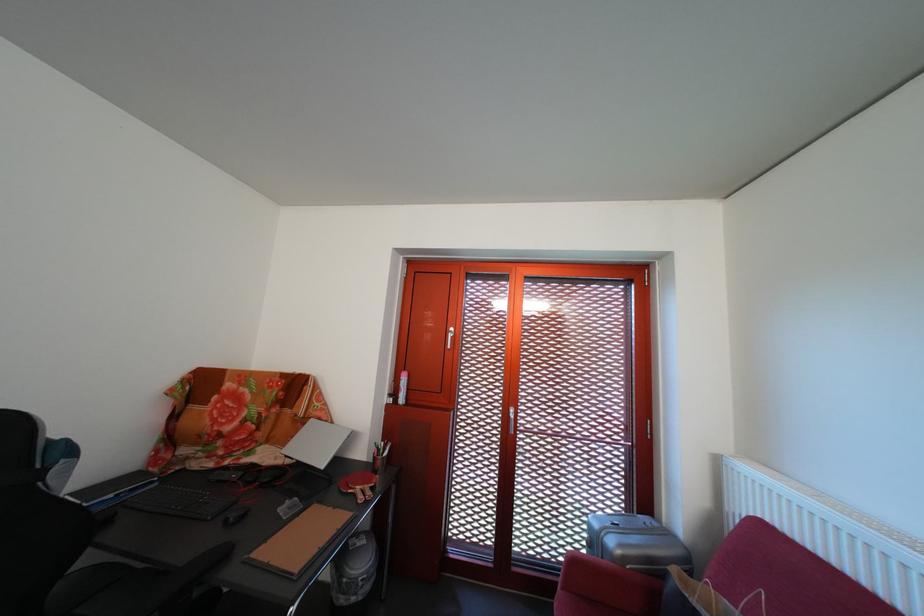
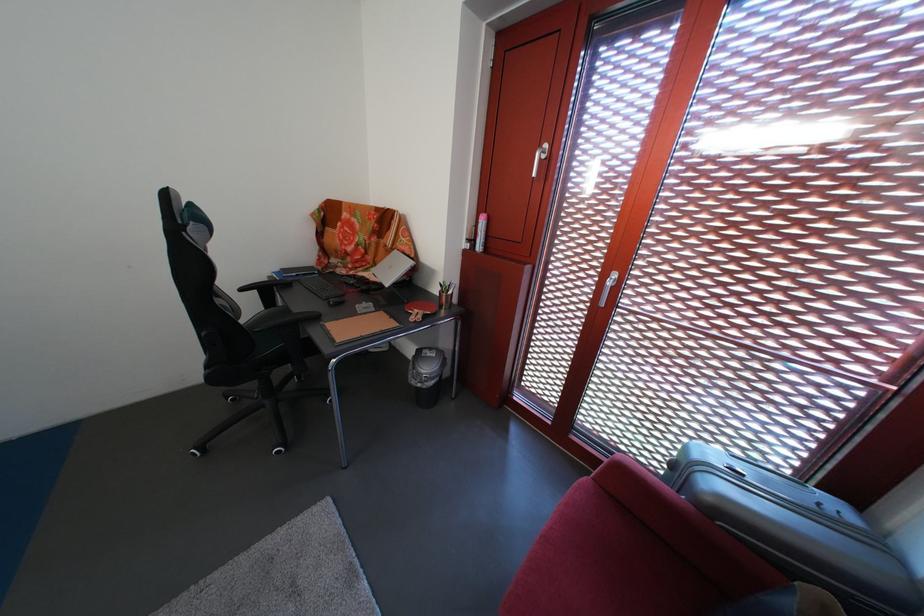
The point at (400, 402) is marked in the first image. Where is the corresponding point in the second image?

(479, 246)